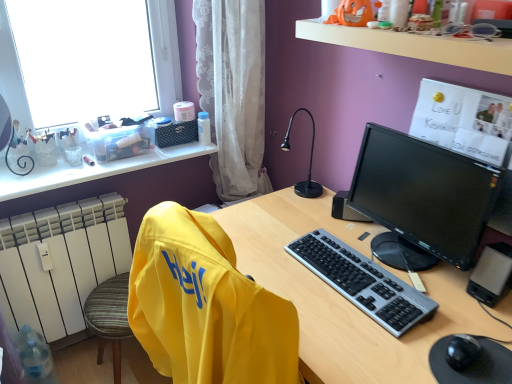
The height and width of the screenshot is (384, 512). In order to click on free area in between black plastic keyboard at center and black plastic speaker at right in this screenshot , I will do point(360,240).